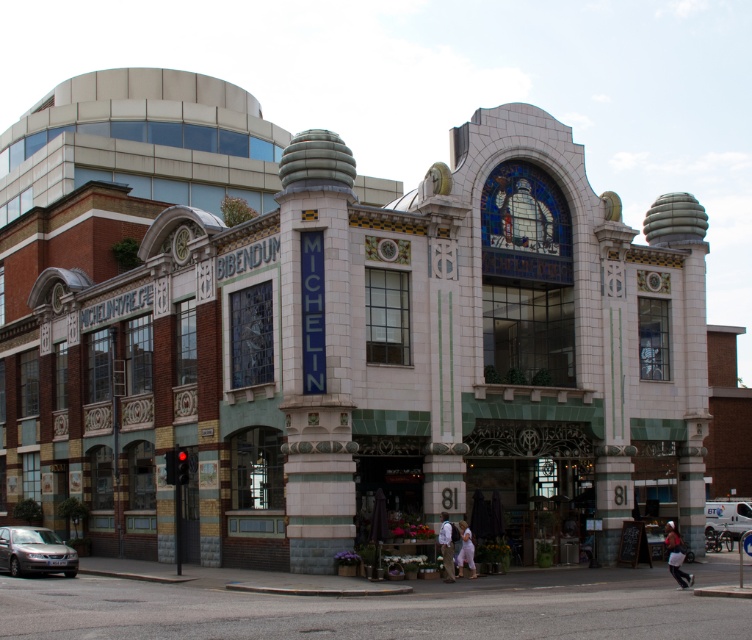
Question: Which point is farther from the camera taking this photo?

Choices:
 (A) (74, 572)
 (B) (86, 266)

Answer: (B)

Question: Which point is closer to the camera?

Choices:
 (A) silver metallic car at lower left
 (B) white tile department store at center

Answer: (B)

Question: Is white tile department store at center closer to camera compared to silver metallic car at lower left?

Choices:
 (A) yes
 (B) no

Answer: (A)

Question: In this image, where is white tile department store at center located relative to silver metallic car at lower left?

Choices:
 (A) right
 (B) left

Answer: (A)

Question: Which object is closer to the camera taking this photo?

Choices:
 (A) silver metallic car at lower left
 (B) white tile department store at center

Answer: (B)

Question: Can you confirm if white tile department store at center is positioned to the left of silver metallic car at lower left?

Choices:
 (A) no
 (B) yes

Answer: (A)